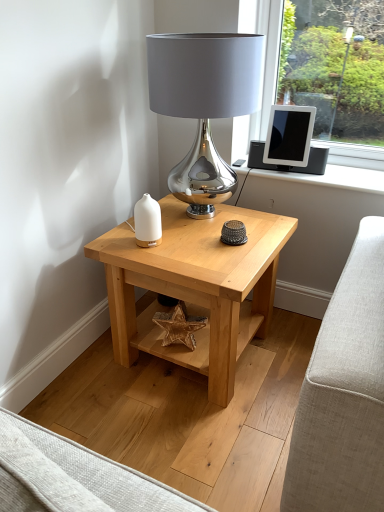
At what (x,y) coordinates should I click in order to perform the action: click on free region on the left part of white matte vase at center. Please return your answer as a coordinate pair (x, y). The image size is (384, 512). Looking at the image, I should click on (117, 244).